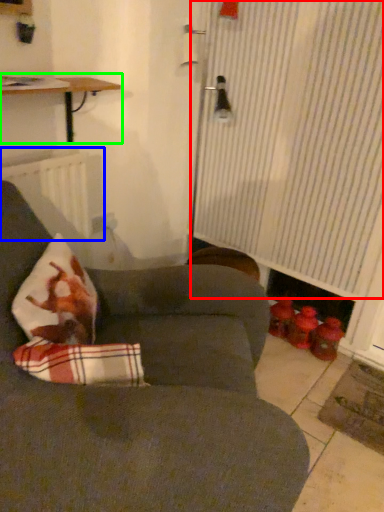
Question: Considering the real-world distances, which object is farthest from curtain (highlighted by a red box)? radiator (highlighted by a blue box) or table (highlighted by a green box)?

Choices:
 (A) radiator
 (B) table

Answer: (A)